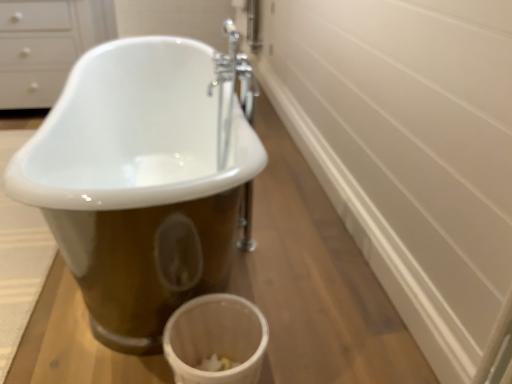
Question: From a real-world perspective, is white textured bath mat at lower left below white glossy drawer at upper left?

Choices:
 (A) no
 (B) yes

Answer: (B)

Question: From a real-world perspective, does white textured bath mat at lower left stand above white glossy drawer at upper left?

Choices:
 (A) no
 (B) yes

Answer: (A)

Question: Can you confirm if white textured bath mat at lower left is smaller than white glossy drawer at upper left?

Choices:
 (A) yes
 (B) no

Answer: (A)

Question: Is white textured bath mat at lower left to the left of white glossy drawer at upper left from the viewer's perspective?

Choices:
 (A) yes
 (B) no

Answer: (B)

Question: Would you say white textured bath mat at lower left contains white glossy drawer at upper left?

Choices:
 (A) yes
 (B) no

Answer: (B)

Question: Could you tell me if white textured bath mat at lower left is turned towards white glossy drawer at upper left?

Choices:
 (A) no
 (B) yes

Answer: (A)

Question: Is white textured bath mat at lower left further to the viewer compared to chrome metallic faucet at center?

Choices:
 (A) no
 (B) yes

Answer: (A)

Question: Is white textured bath mat at lower left bigger than chrome metallic faucet at center?

Choices:
 (A) no
 (B) yes

Answer: (B)

Question: Is white textured bath mat at lower left far from chrome metallic faucet at center?

Choices:
 (A) yes
 (B) no

Answer: (B)

Question: Is white textured bath mat at lower left not inside chrome metallic faucet at center?

Choices:
 (A) yes
 (B) no

Answer: (A)

Question: Can you confirm if white textured bath mat at lower left is positioned to the right of chrome metallic faucet at center?

Choices:
 (A) no
 (B) yes

Answer: (A)

Question: Are white textured bath mat at lower left and chrome metallic faucet at center beside each other?

Choices:
 (A) yes
 (B) no

Answer: (B)

Question: Does white matte toilet bowl at lower center have a smaller size compared to white porcelain bathtub at center?

Choices:
 (A) no
 (B) yes

Answer: (B)